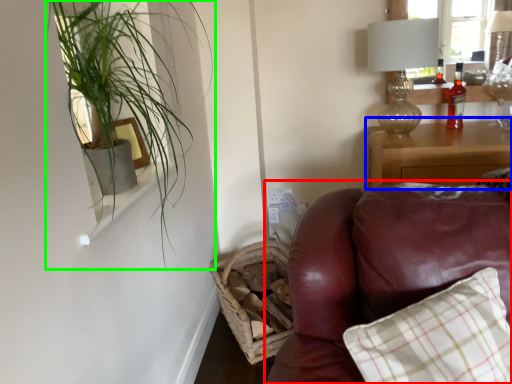
Question: Considering the real-world distances, which object is farthest from studio couch (highlighted by a red box)? nightstand (highlighted by a blue box) or houseplant (highlighted by a green box)?

Choices:
 (A) nightstand
 (B) houseplant

Answer: (A)